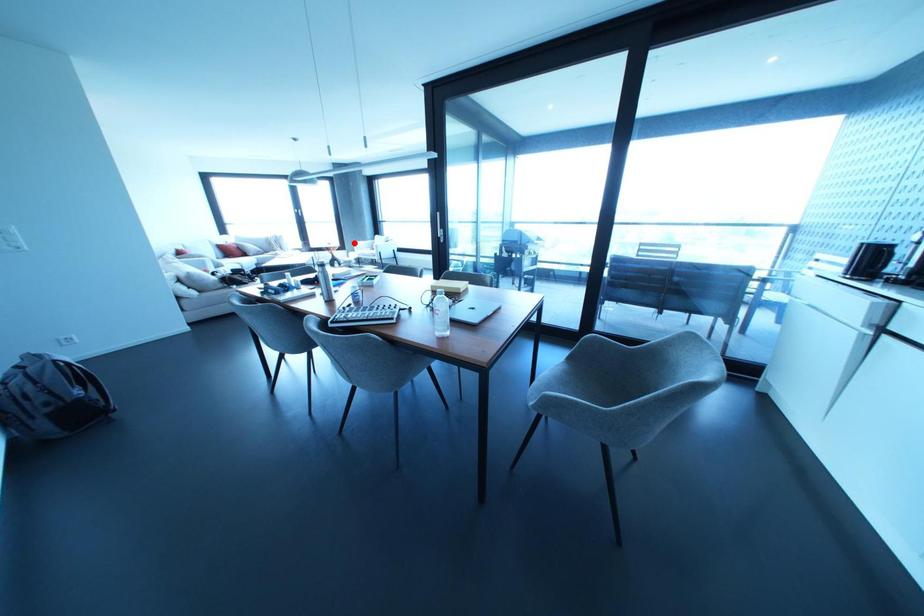
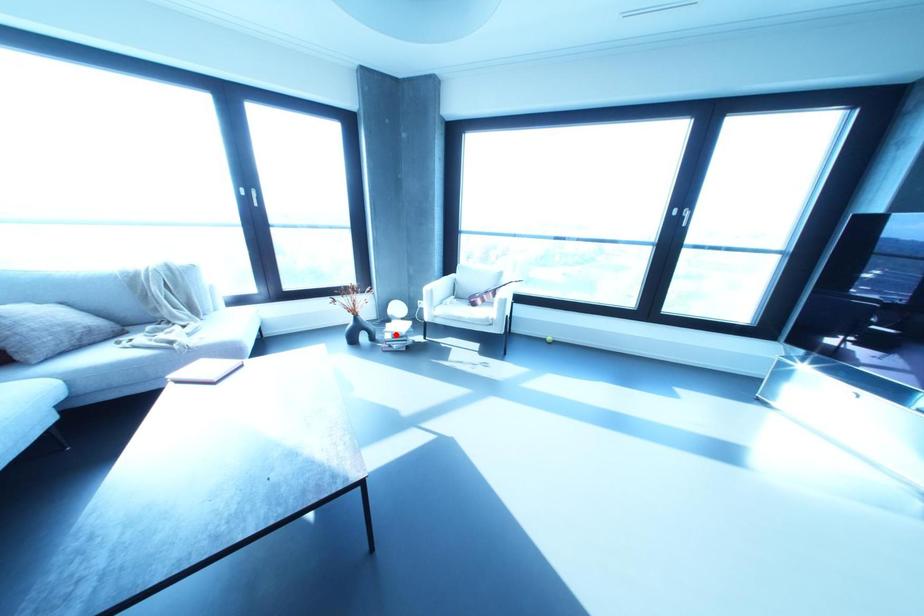
I am providing you with two images of the same scene from different viewpoints. A red point is marked on the first image and another point is marked on the second image. Is the marked point in image1 the same physical position as the marked point in image2?

No